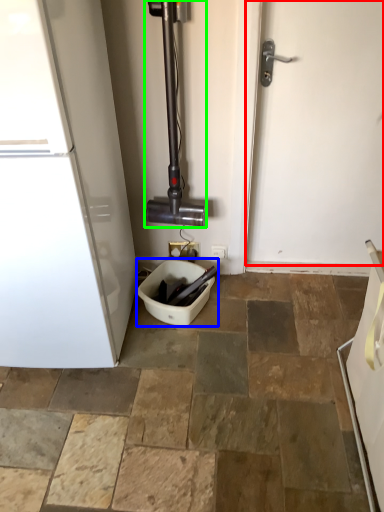
Question: Estimate the real-world distances between objects in this image. Which object is farther from door (highlighted by a red box), toilet bowl (highlighted by a blue box) or pipe (highlighted by a green box)?

Choices:
 (A) toilet bowl
 (B) pipe

Answer: (A)